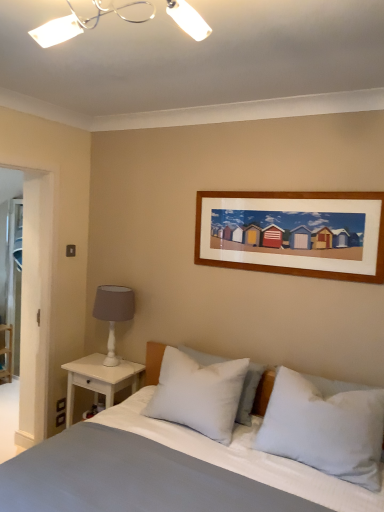
Describe the element at coordinates (70, 27) in the screenshot. The image size is (384, 512). I see `white plastic light fixture at upper center` at that location.

You are a GUI agent. You are given a task and a screenshot of the screen. Output one action in this format:
    pyautogui.click(x=<x>, y=<y>)
    Task: Click on the white plastic light fixture at upper center
    
    Given the screenshot: What is the action you would take?
    pyautogui.click(x=70, y=27)

Find the location of `white wood nightstand at left`. white wood nightstand at left is located at coordinates (99, 379).

Consider the image. What is the approximate height of white wood nightstand at left?

It is 20.57 inches.

The height and width of the screenshot is (512, 384). Describe the element at coordinates (6, 353) in the screenshot. I see `white painted wood shelf at left` at that location.

This screenshot has width=384, height=512. Describe the element at coordinates (198, 394) in the screenshot. I see `white soft pillow at center, which is the third pillow in right-to-left order` at that location.

At what (x,y) coordinates should I click in order to perform the action: click on white matte table lamp at left. Please return your answer as a coordinate pair (x, y). This screenshot has width=384, height=512. Looking at the image, I should click on (113, 313).

Based on their positions, is smooth cotton bed at center located to the left or right of white matte table lamp at left?

Clearly, smooth cotton bed at center is on the right of white matte table lamp at left in the image.

Looking at this image, between smooth cotton bed at center and white matte table lamp at left, which one has less height?

With less height is white matte table lamp at left.

Between smooth cotton bed at center and white matte table lamp at left, which one is positioned behind?

white matte table lamp at left is further from the camera.

Who is bigger, smooth cotton bed at center or white soft pillow at center, the first pillow viewed from the left?

smooth cotton bed at center is bigger.

Does smooth cotton bed at center have a lesser width compared to white soft pillow at center, which is the third pillow in right-to-left order?

No.

Which is behind, point (248, 450) or point (181, 353)?

Positioned behind is point (181, 353).

From a real-world perspective, is smooth cotton bed at center located beneath white soft pillow at center, the first pillow viewed from the left?

Indeed, from a real-world perspective, smooth cotton bed at center is positioned beneath white soft pillow at center, the first pillow viewed from the left.

From the image's perspective, is white soft pillow at center, the first pillow viewed from the left, on top of white painted wood shelf at left?

Indeed, from the image's perspective, white soft pillow at center, the first pillow viewed from the left, is shown above white painted wood shelf at left.

Is white soft pillow at center, which is the third pillow in right-to-left order, inside the boundaries of white painted wood shelf at left, or outside?

white soft pillow at center, which is the third pillow in right-to-left order, lies outside white painted wood shelf at left.

Which of these two, white soft pillow at center, the first pillow viewed from the left, or white painted wood shelf at left, is wider?

With larger width is white soft pillow at center, the first pillow viewed from the left.

Which is behind, point (223, 442) or point (2, 365)?

Positioned behind is point (2, 365).

Can we say white soft pillow at center, the first pillow viewed from the left, lies outside white matte table lamp at left?

white soft pillow at center, the first pillow viewed from the left, is positioned outside white matte table lamp at left.

How much distance is there between white soft pillow at center, the first pillow viewed from the left, and white matte table lamp at left?

white soft pillow at center, the first pillow viewed from the left, is 28.95 inches from white matte table lamp at left.

Does point (178, 392) come in front of point (129, 313)?

Yes, it is.

Can you confirm if white soft pillow at center, the first pillow viewed from the left, is taller than white matte table lamp at left?

In fact, white soft pillow at center, the first pillow viewed from the left, may be shorter than white matte table lamp at left.

From a real-world perspective, relative to white wood nightstand at left, is white matte table lamp at left vertically above or below?

From a real-world perspective, white matte table lamp at left is physically above white wood nightstand at left.

Is white matte table lamp at left inside or outside of white wood nightstand at left?

white matte table lamp at left is located beyond the bounds of white wood nightstand at left.

Does point (122, 320) come in front of point (96, 385)?

That is False.

Could you tell me if white soft pillow at center, which is the third pillow in right-to-left order, is turned towards white plastic light fixture at upper center?

No.

Is point (176, 411) more distant than point (133, 3)?

Yes, it is behind point (133, 3).

Is white soft pillow at center, which is the third pillow in right-to-left order, placed right next to white plastic light fixture at upper center?

They are not placed beside each other.

Is white soft pillow at center, which is the third pillow in right-to-left order, surrounding white plastic light fixture at upper center?

No, white plastic light fixture at upper center is not inside white soft pillow at center, which is the third pillow in right-to-left order.

From the image's perspective, would you say white matte table lamp at left is positioned over white soft pillow at center, marked as the first pillow in a right-to-left arrangement?

Correct, white matte table lamp at left appears higher than white soft pillow at center, marked as the first pillow in a right-to-left arrangement, in the image.

Is point (100, 293) positioned behind point (289, 434)?

Yes, it is behind point (289, 434).

Which of these two, white matte table lamp at left or white soft pillow at center, marked as the first pillow in a right-to-left arrangement, is thinner?

With smaller width is white matte table lamp at left.

Considering the relative sizes of white matte table lamp at left and white soft pillow at center, marked as the first pillow in a right-to-left arrangement, in the image provided, is white matte table lamp at left bigger than white soft pillow at center, marked as the first pillow in a right-to-left arrangement,?

Actually, white matte table lamp at left might be smaller than white soft pillow at center, marked as the first pillow in a right-to-left arrangement.

This screenshot has width=384, height=512. Identify the location of table lamp above the smooth cotton bed at center (from a real-world perspective). (113, 313).

I want to click on bed on the left side of white soft pillow at center, the first pillow viewed from the left, so click(x=160, y=472).

When comparing their distances from white soft pillow at center, the first pillow viewed from the left, does white soft pillow at center, marked as the first pillow in a right-to-left arrangement, or white plastic light fixture at upper center seem closer?

Among the two, white soft pillow at center, marked as the first pillow in a right-to-left arrangement, is located nearer to white soft pillow at center, the first pillow viewed from the left.

In the scene shown: Considering their positions, is white soft pillow at center, which is counted as the third pillow, starting from the left, positioned further to smooth cotton bed at center than white soft pillow at center, the 2th pillow from the left?

white soft pillow at center, the 2th pillow from the left, is further to smooth cotton bed at center.

Based on their spatial positions, is white matte table lamp at left or white soft pillow at center, the 2th pillow from the left, closer to white plastic light fixture at upper center?

white matte table lamp at left.

Considering their positions, is white wood nightstand at left positioned further to white soft pillow at center, the 2th pillow from the right, than smooth cotton bed at center?

white wood nightstand at left lies further to white soft pillow at center, the 2th pillow from the right, than the other object.

Looking at the image, which one is located closer to white soft pillow at center, which is the third pillow in right-to-left order, white wood nightstand at left or white plastic light fixture at upper center?

white wood nightstand at left.

Looking at this image, estimate the real-world distances between objects in this image. Which object is closer to white matte table lamp at left, white soft pillow at center, marked as the first pillow in a right-to-left arrangement, or white wood nightstand at left?

Based on the image, white wood nightstand at left appears to be nearer to white matte table lamp at left.

Estimate the real-world distances between objects in this image. Which object is closer to white painted wood shelf at left, white soft pillow at center, which is the third pillow in right-to-left order, or white wood nightstand at left?

white wood nightstand at left.

Looking at the image, which one is located further to white soft pillow at center, which is counted as the third pillow, starting from the left, smooth cotton bed at center or white soft pillow at center, the first pillow viewed from the left?

The object further to white soft pillow at center, which is counted as the third pillow, starting from the left, is white soft pillow at center, the first pillow viewed from the left.

The width and height of the screenshot is (384, 512). What are the coordinates of `table lamp situated between white wood nightstand at left and white soft pillow at center, the 2th pillow from the left, from left to right` in the screenshot? It's located at (113, 313).

The image size is (384, 512). I want to click on nightstand between white painted wood shelf at left and white soft pillow at center, the 2th pillow from the left, in the horizontal direction, so click(x=99, y=379).

Where is `pillow between white painted wood shelf at left and white soft pillow at center, the 2th pillow from the right`? pillow between white painted wood shelf at left and white soft pillow at center, the 2th pillow from the right is located at coordinates (198, 394).

The image size is (384, 512). In order to click on light fixture located between smooth cotton bed at center and white painted wood shelf at left in the depth direction in this screenshot , I will do `click(70, 27)`.